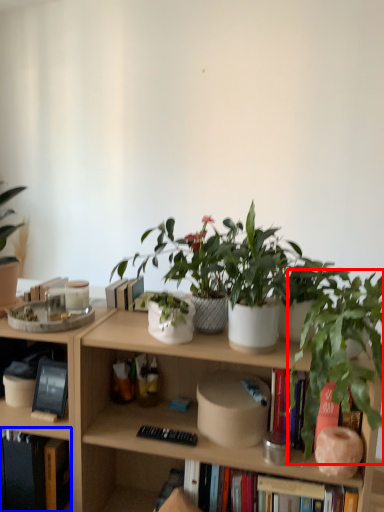
Question: Which point is further to the camera, houseplant (highlighted by a red box) or book (highlighted by a blue box)?

Choices:
 (A) houseplant
 (B) book

Answer: (B)